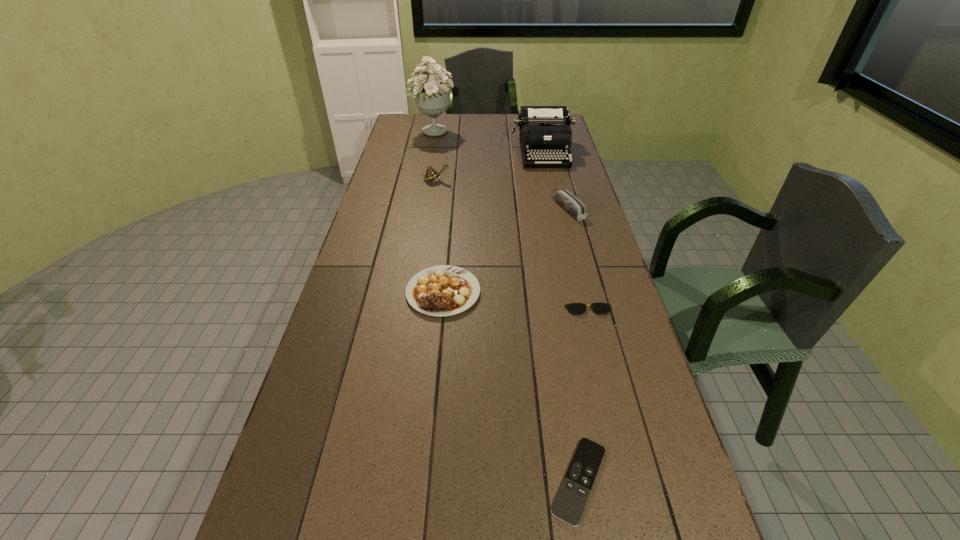
This screenshot has height=540, width=960. I want to click on spectacles located at the right edge, so click(x=574, y=308).

Where is `remote control that is positioned at the right edge`? The image size is (960, 540). remote control that is positioned at the right edge is located at coordinates (573, 494).

I want to click on object situated at the far left corner, so click(x=433, y=98).

At what (x,y) coordinates should I click in order to perform the action: click on vacant region at the far edge of the desktop. Please return your answer as a coordinate pair (x, y). The height and width of the screenshot is (540, 960). Looking at the image, I should click on (501, 134).

You are a GUI agent. You are given a task and a screenshot of the screen. Output one action in this format:
    pyautogui.click(x=<x>, y=<y>)
    Task: Click on the vacant space at the left edge of the desktop
    This screenshot has width=960, height=540.
    Given the screenshot: What is the action you would take?
    pyautogui.click(x=401, y=241)

This screenshot has height=540, width=960. What are the coordinates of `vacant space at the right edge of the desktop` in the screenshot? It's located at (603, 318).

Where is `empty location between the spectacles and the remote control`? empty location between the spectacles and the remote control is located at coordinates (584, 395).

Locate an element on the screen. The height and width of the screenshot is (540, 960). unoccupied position between the spectacles and the third shortest object is located at coordinates pyautogui.click(x=516, y=301).

At what (x,y) coordinates should I click in order to perform the action: click on free space between the sixth shortest object and the fourth tallest object. Please return your answer as a coordinate pair (x, y). Looking at the image, I should click on (556, 180).

Where is `empty location between the spectacles and the bouquet`? The image size is (960, 540). empty location between the spectacles and the bouquet is located at coordinates (511, 221).